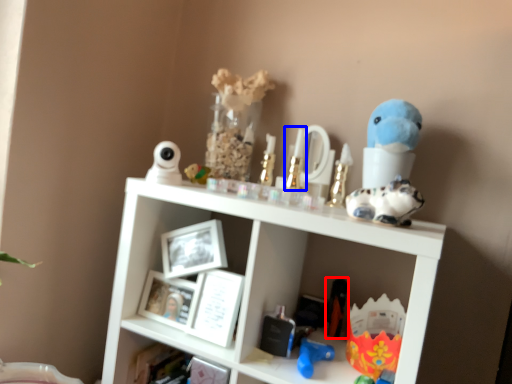
Question: Which object is further to the camera taking this photo, toy (highlighted by a red box) or toy (highlighted by a blue box)?

Choices:
 (A) toy
 (B) toy

Answer: (A)